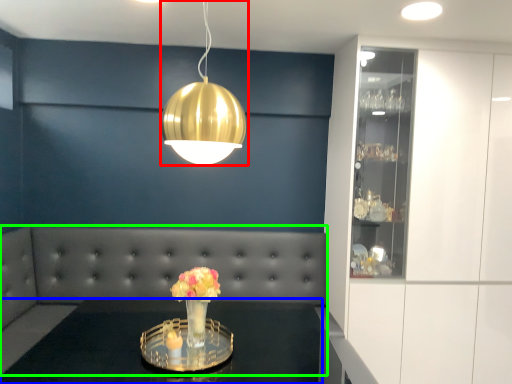
Question: Which object is the farthest from lamp (highlighted by a red box)? Choose among these: table (highlighted by a blue box) or couch (highlighted by a green box).

Choices:
 (A) table
 (B) couch

Answer: (B)